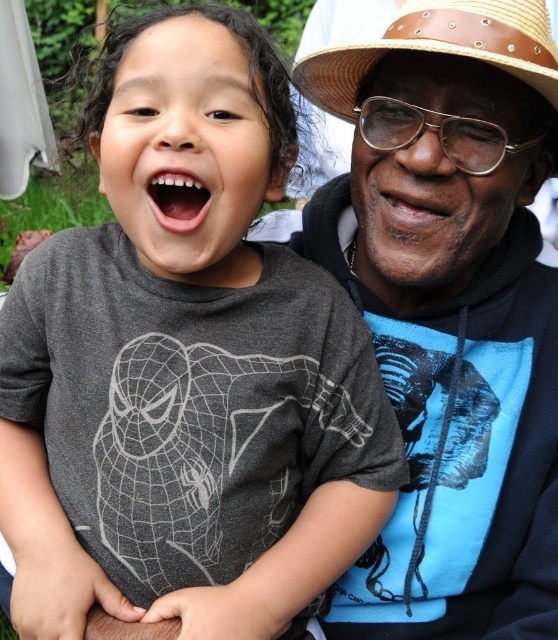
Can you confirm if gray matte t-shirt at left is bigger than braided straw cowboy hat at upper right?

Correct, gray matte t-shirt at left is larger in size than braided straw cowboy hat at upper right.

Is point (156, 38) closer to camera compared to point (493, 3)?

Yes, point (156, 38) is closer to viewer.

Which is in front, point (45, 508) or point (369, 42)?

Point (369, 42)

Locate an element on the screen. gray matte t-shirt at left is located at coordinates (233, 269).

Is blue cotton hoodie at upper right closer to camera compared to braided straw cowboy hat at upper right?

No.

Where is `blue cotton hoodie at upper right`? This screenshot has height=640, width=558. blue cotton hoodie at upper right is located at coordinates (449, 310).

The image size is (558, 640). In order to click on blue cotton hoodie at upper right in this screenshot , I will do `click(449, 310)`.

Who is taller, blue cotton hoodie at upper right or gray matte t-shirt at left?

With more height is blue cotton hoodie at upper right.

Who is more distant from viewer, (x=549, y=168) or (x=151, y=61)?

The point (x=549, y=168) is more distant.

Find the location of a particular element. The width and height of the screenshot is (558, 640). blue cotton hoodie at upper right is located at coordinates (449, 310).